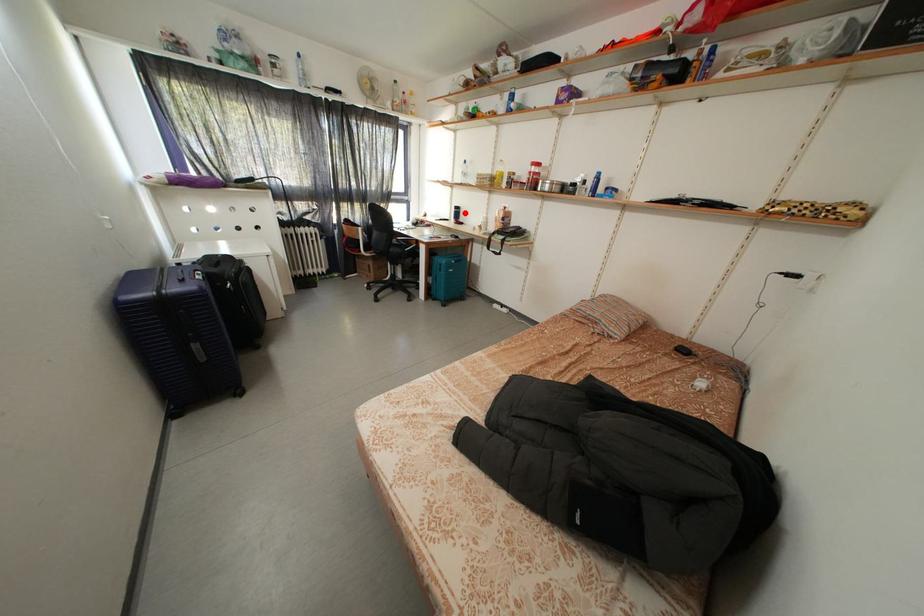
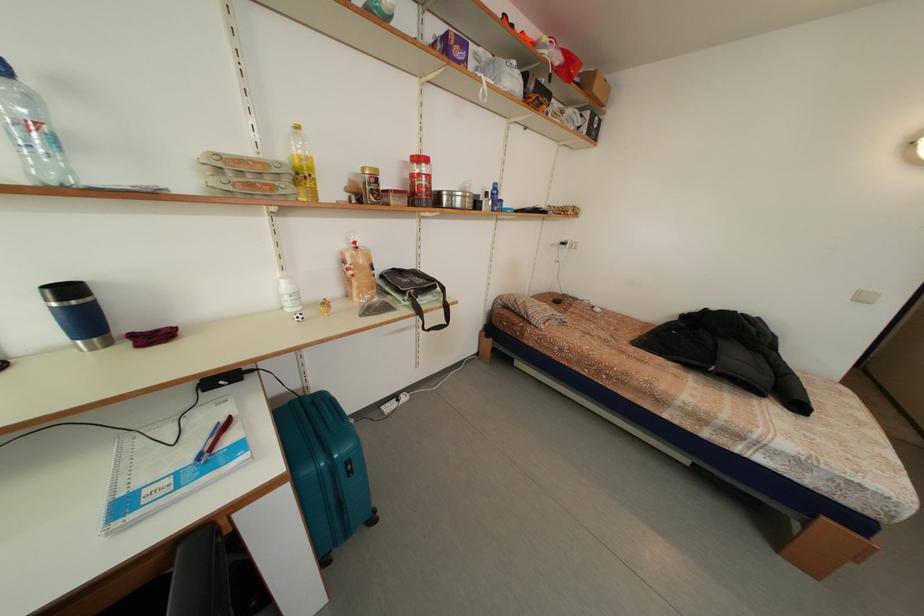
Locate, in the second image, the point that corresponds to the highlighted location in the first image.

(78, 296)